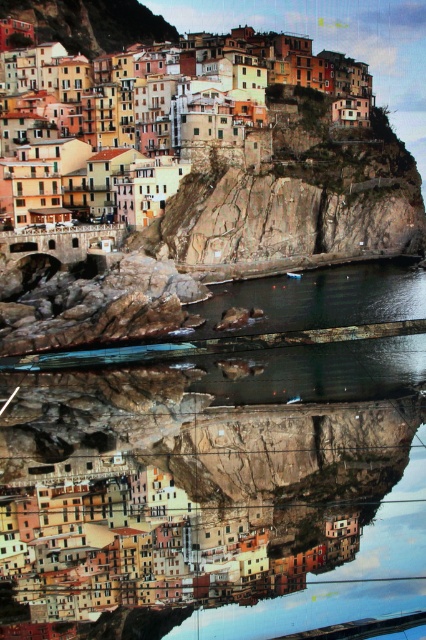
Question: Is transparent glass water at center above multicolored stone buildings at upper center?

Choices:
 (A) yes
 (B) no

Answer: (B)

Question: Which point is closer to the camera?

Choices:
 (A) multicolored stone buildings at upper center
 (B) transparent glass water at center

Answer: (B)

Question: Which of the following is the closest to the observer?

Choices:
 (A) transparent glass water at center
 (B) multicolored stone buildings at upper center

Answer: (A)

Question: Is transparent glass water at center above multicolored stone buildings at upper center?

Choices:
 (A) no
 (B) yes

Answer: (A)

Question: Can you confirm if transparent glass water at center is thinner than multicolored stone buildings at upper center?

Choices:
 (A) no
 (B) yes

Answer: (B)